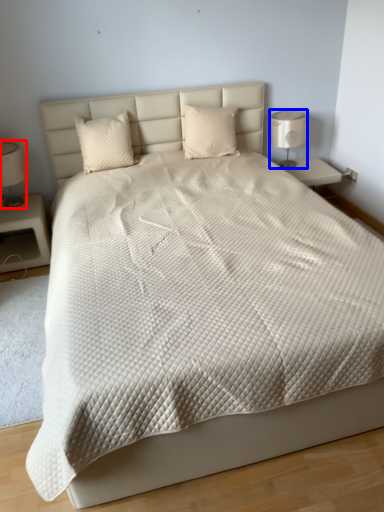
Question: Which point is further to the camera, bedside lamp (highlighted by a red box) or bedside lamp (highlighted by a blue box)?

Choices:
 (A) bedside lamp
 (B) bedside lamp

Answer: (B)